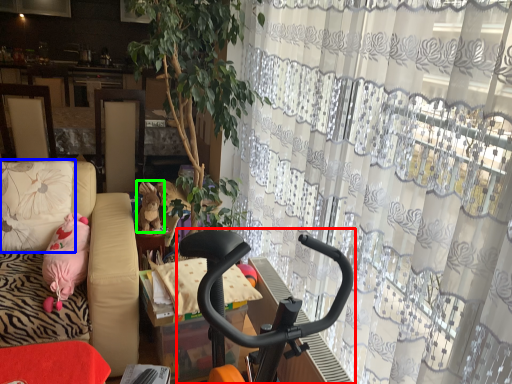
Question: Estimate the real-world distances between objects in this image. Which object is closer to baby carriage (highlighted by a red box), pillow (highlighted by a blue box) or animal (highlighted by a green box)?

Choices:
 (A) pillow
 (B) animal

Answer: (B)